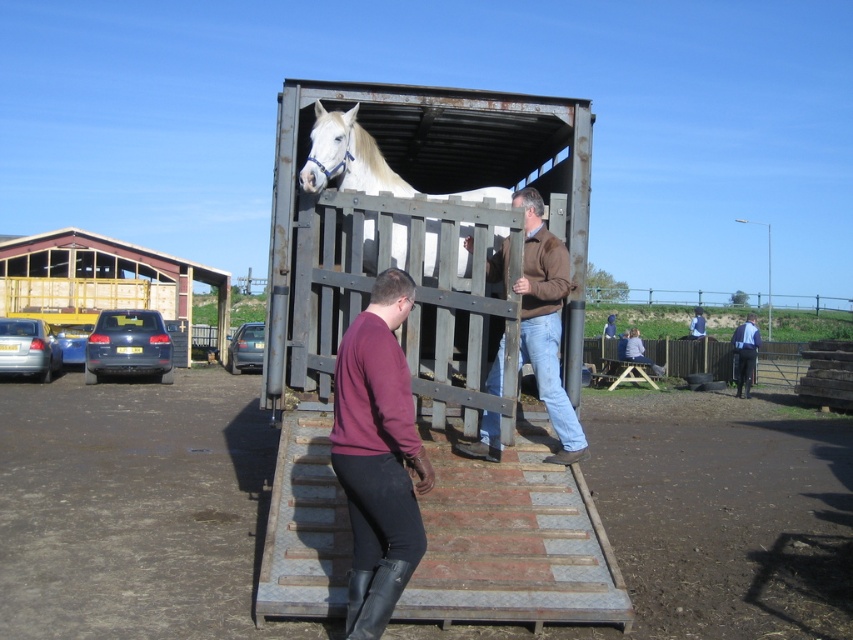
You are standing at the entrance of the barn and want to determine which of the two points, point (343, 172) or point (747, 356), is closer to you. Based on the scene, which point is nearer?

Point (343, 172) is closer to the camera than point (747, 356), so it is the nearer point.

You are a farmer checking the jackets in your trailer. You see the brown leather jacket at center and the blue denim jacket at right. Which jacket is placed higher up in the trailer?

The brown leather jacket at center is placed higher up in the trailer as it is above the blue denim jacket at right.